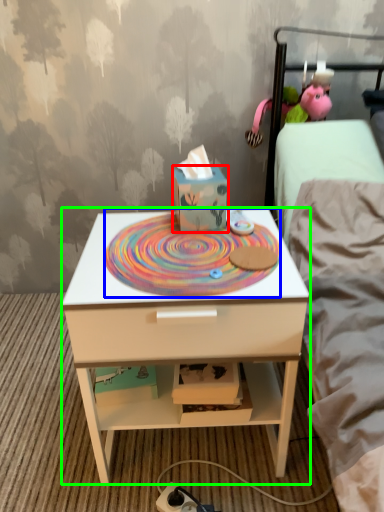
Question: Based on their relative distances, which object is nearer to cardboard box (highlighted by a red box)? Choose from design (highlighted by a blue box) and nightstand (highlighted by a green box).

Choices:
 (A) design
 (B) nightstand

Answer: (A)